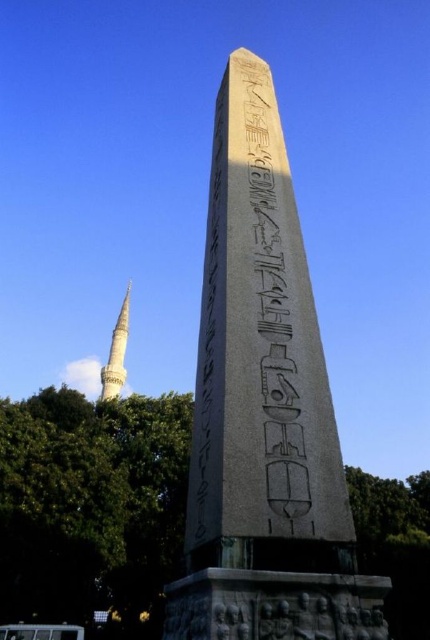
Is bronze textured obelisk at center wider than white glossy minaret at lower left?

Incorrect, bronze textured obelisk at center's width does not surpass white glossy minaret at lower left's.

Does bronze textured obelisk at center appear over white glossy minaret at lower left?

Indeed, bronze textured obelisk at center is positioned over white glossy minaret at lower left.

Identify the location of bronze textured obelisk at center. The width and height of the screenshot is (430, 640). (264, 410).

Is point (55, 572) less distant than point (129, 298)?

Yes, point (55, 572) is closer to viewer.

Is point (146, 504) positioned behind point (108, 356)?

No, it is in front of (108, 356).

I want to click on green leafy tree at center, so click(92, 508).

In the scene shown: Which is more to the left, black stone hieroglyphs at center or white glossy minaret at lower left?

From the viewer's perspective, white glossy minaret at lower left appears more on the left side.

Can you confirm if black stone hieroglyphs at center is wider than white glossy minaret at lower left?

No, black stone hieroglyphs at center is not wider than white glossy minaret at lower left.

Who is more forward, (x=215, y=291) or (x=117, y=380)?

Point (x=215, y=291) is more forward.

You are a GUI agent. You are given a task and a screenshot of the screen. Output one action in this format:
    pyautogui.click(x=<x>, y=<y>)
    Task: Click on the black stone hieroglyphs at center
    This screenshot has width=430, height=640.
    Given the screenshot: What is the action you would take?
    pyautogui.click(x=211, y=349)